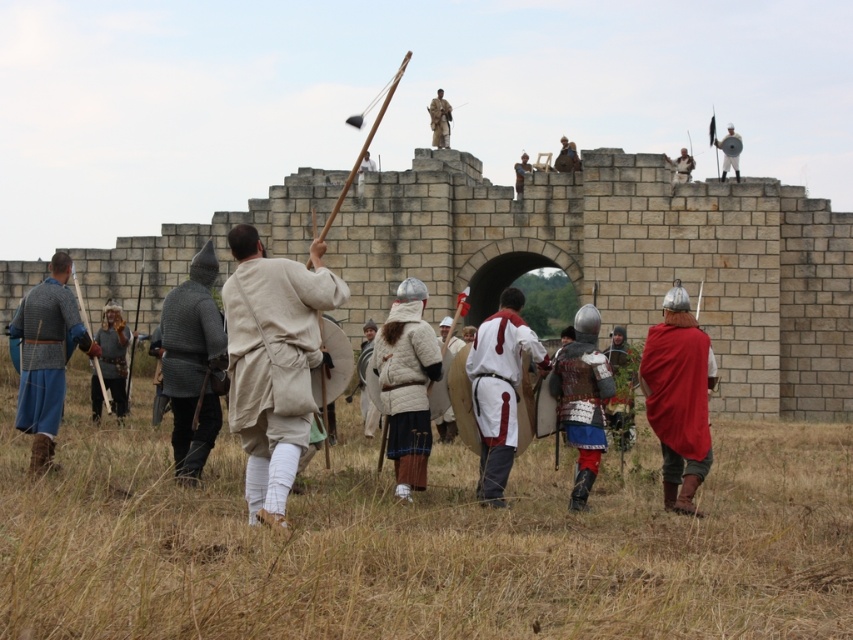
Question: Considering the relative positions of beige linen tunic at center and silver metallic helmet at upper right in the image provided, where is beige linen tunic at center located with respect to silver metallic helmet at upper right?

Choices:
 (A) left
 (B) right

Answer: (A)

Question: Can you confirm if red cloth cape at center is positioned to the right of metallic chainmail armor at left?

Choices:
 (A) no
 (B) yes

Answer: (B)

Question: Which point is closer to the camera?

Choices:
 (A) (126, 369)
 (B) (323, 243)
 (C) (434, 109)

Answer: (B)

Question: Which of these objects is positioned farthest from the red cloth cape at center?

Choices:
 (A) metallic chainmail armor at left
 (B) white leather tunic at center

Answer: (A)

Question: Estimate the real-world distances between objects in this image. Which object is farther from the silver metallic helmet at upper right?

Choices:
 (A) white leather tunic at center
 (B) brown leather armor at upper center
 (C) beige linen tunic at center

Answer: (C)

Question: Does red cloth cape at center have a smaller size compared to silver metallic helmet at upper right?

Choices:
 (A) no
 (B) yes

Answer: (A)